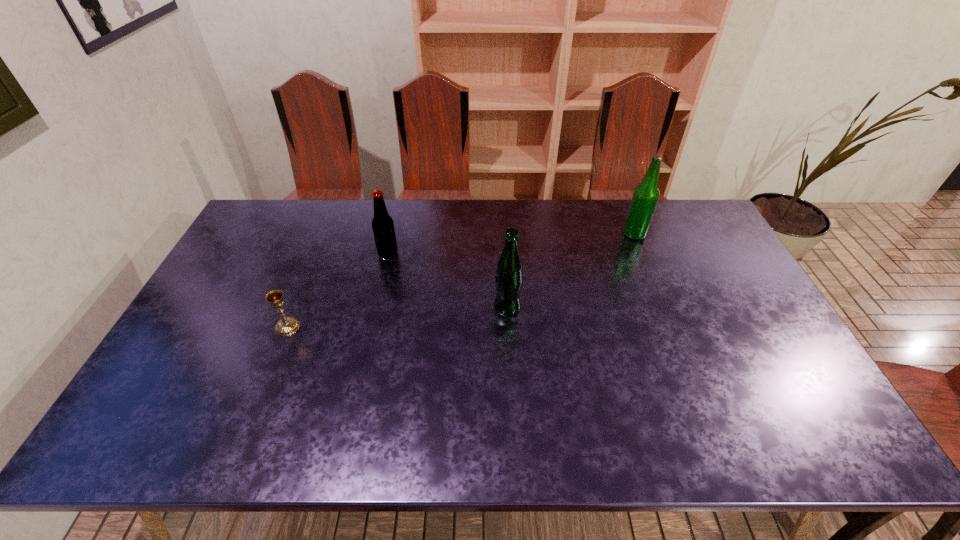
Identify the location of the rightmost beer bottle. This screenshot has height=540, width=960. (646, 195).

In order to click on the farthest beer bottle in this screenshot , I will do `click(646, 195)`.

Where is `the second beer bottle from right to left`? Image resolution: width=960 pixels, height=540 pixels. the second beer bottle from right to left is located at coordinates click(509, 276).

Image resolution: width=960 pixels, height=540 pixels. In order to click on the nearest beer bottle in this screenshot , I will do `click(509, 276)`.

The image size is (960, 540). In order to click on the third nearest object in this screenshot , I will do `click(382, 224)`.

Find the location of a particular element. The height and width of the screenshot is (540, 960). the third object from right to left is located at coordinates (382, 224).

In order to click on chalice in this screenshot , I will do `click(285, 326)`.

The image size is (960, 540). Find the location of `the shortest object`. the shortest object is located at coordinates (285, 326).

The height and width of the screenshot is (540, 960). I want to click on vacant space located on the label of the rightmost object, so click(557, 234).

You are a GUI agent. You are given a task and a screenshot of the screen. Output one action in this format:
    pyautogui.click(x=<x>, y=<y>)
    Task: Click on the vacant area located 0.260m on the label of the rightmost object
    The width and height of the screenshot is (960, 540).
    Given the screenshot: What is the action you would take?
    (548, 234)